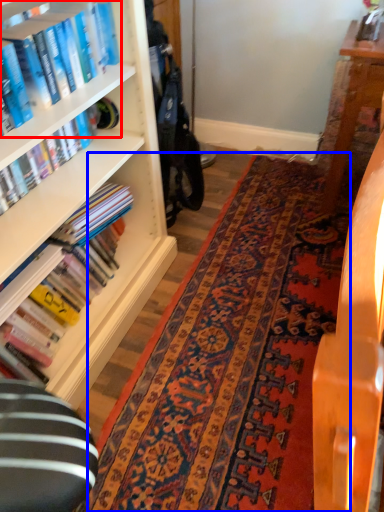
Question: Which point is further to the camera, book (highlighted by a red box) or mat (highlighted by a blue box)?

Choices:
 (A) book
 (B) mat

Answer: (B)